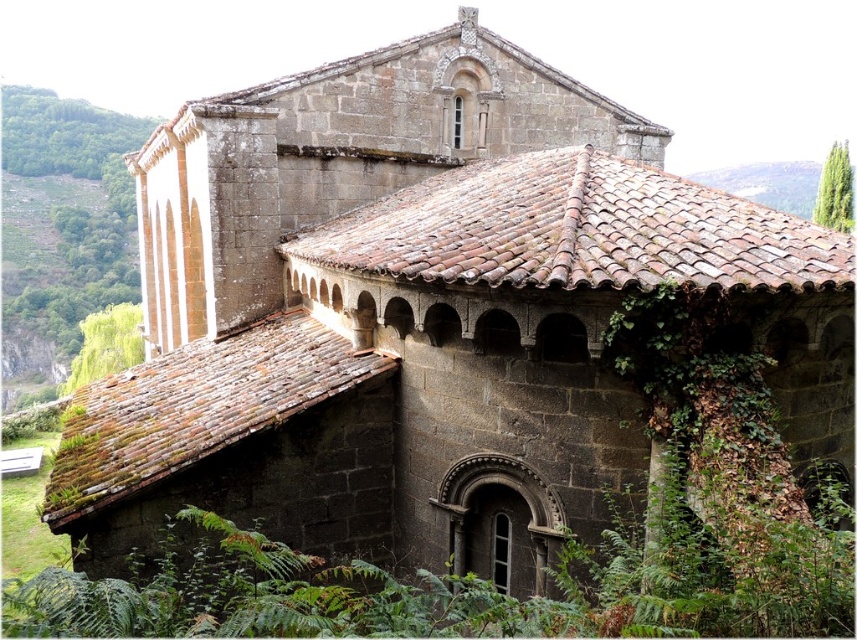
Which is more to the right, green leafy vegetation at upper left or green leafy tree at upper right?

Positioned to the right is green leafy tree at upper right.

Identify the location of green leafy vegetation at upper left. (63, 224).